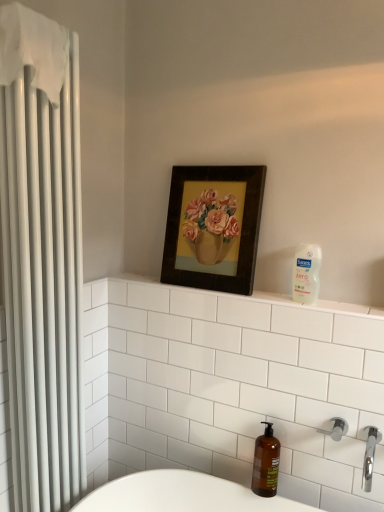
Image resolution: width=384 pixels, height=512 pixels. In order to click on vacant space to the right of white plastic bottle at upper right in this screenshot , I will do `click(356, 306)`.